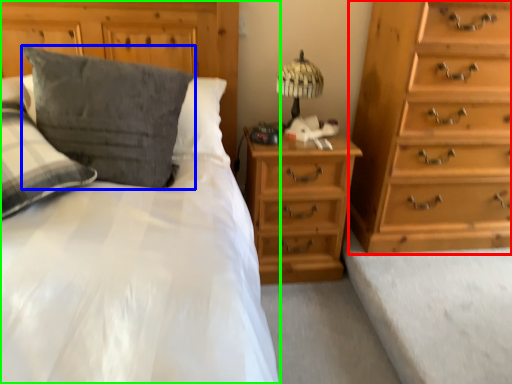
Question: Considering the real-world distances, which object is farthest from chest of drawers (highlighted by a red box)? pillow (highlighted by a blue box) or bed (highlighted by a green box)?

Choices:
 (A) pillow
 (B) bed

Answer: (A)